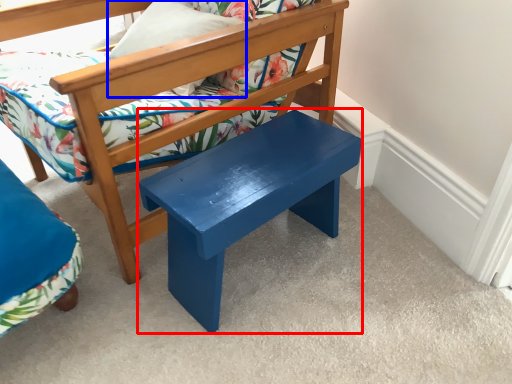
Question: Among these objects, which one is nearest to the camera, stool (highlighted by a red box) or pillow (highlighted by a blue box)?

Choices:
 (A) stool
 (B) pillow

Answer: (A)